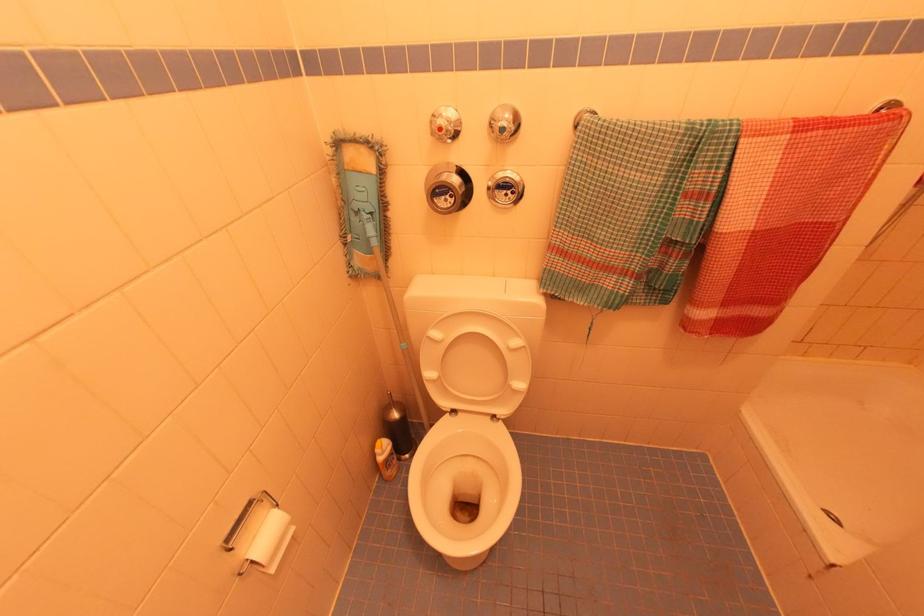
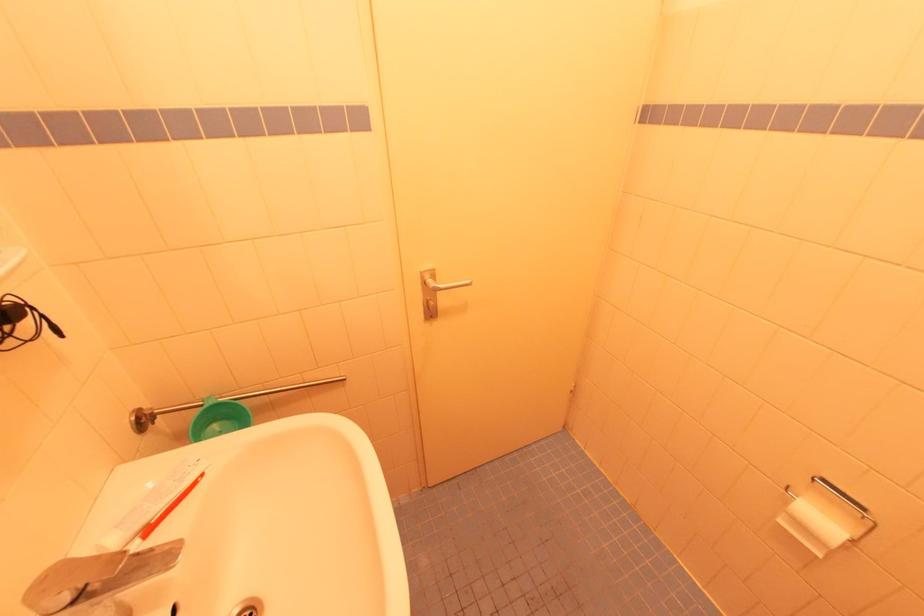
Locate, in the second image, the point that corresponds to the point at 274,570 in the first image.

(784, 523)